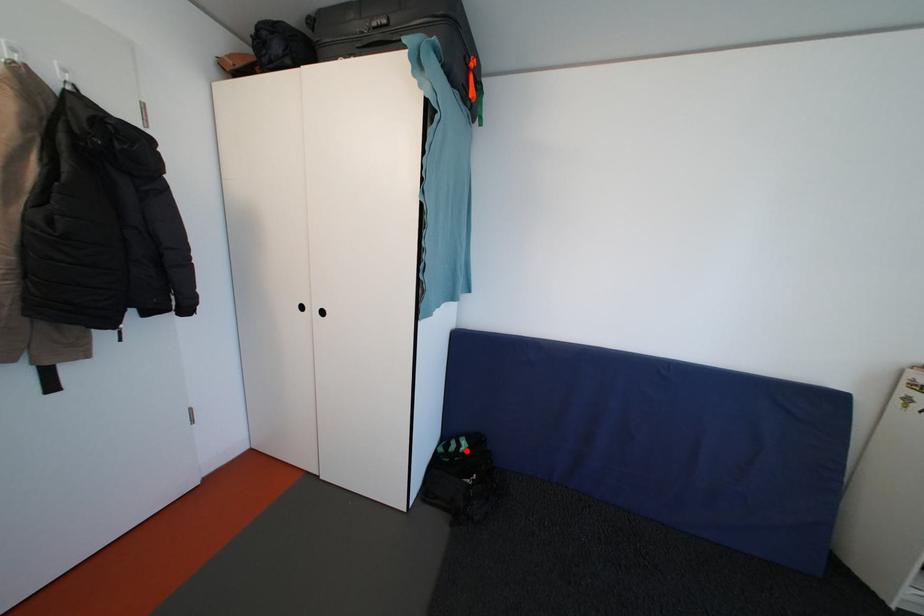
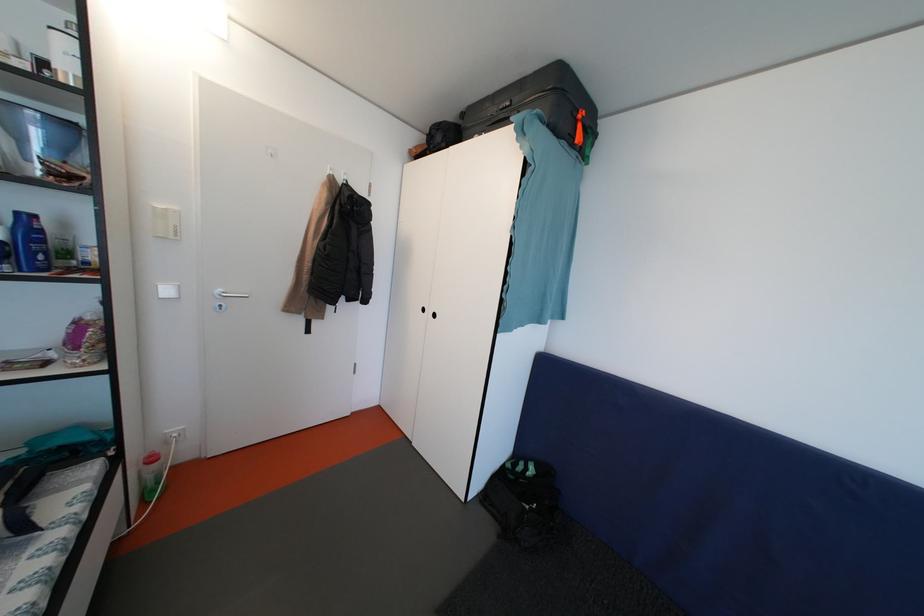
The point at the highlighted location is marked in the first image. Where is the corresponding point in the second image?

(533, 474)